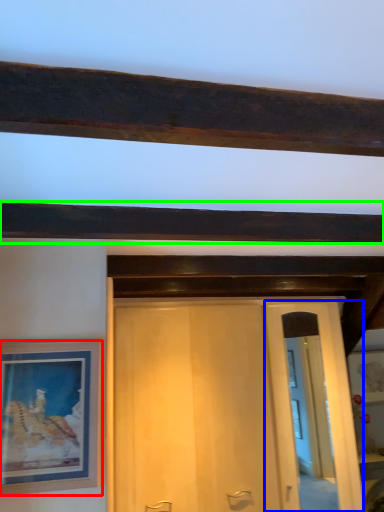
Question: Estimate the real-world distances between objects in this image. Which object is farther from picture frame (highlighted by a red box), glass door (highlighted by a blue box) or plank (highlighted by a green box)?

Choices:
 (A) glass door
 (B) plank

Answer: (A)